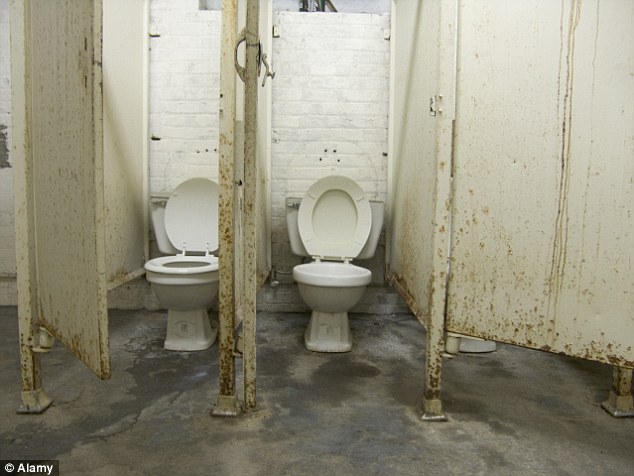
The height and width of the screenshot is (476, 634). Identify the location of stall walls. (129, 183), (425, 153).